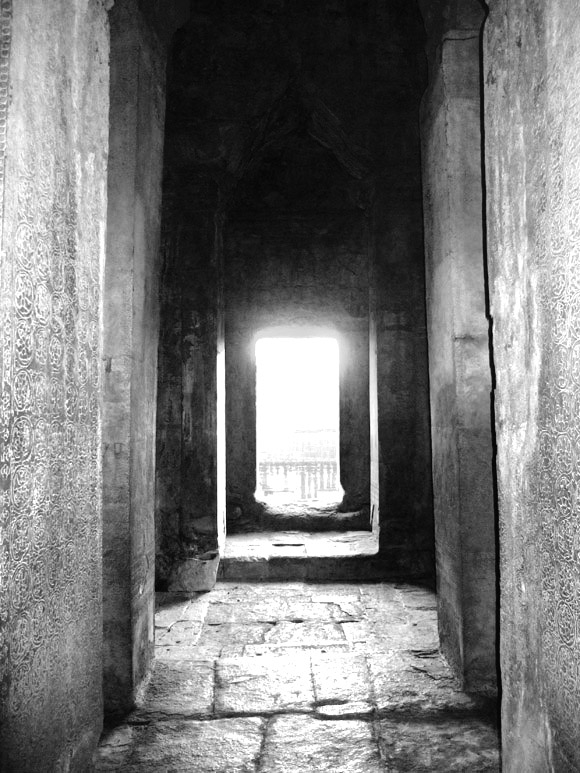
The width and height of the screenshot is (580, 773). Identify the location of floor. (284, 686).